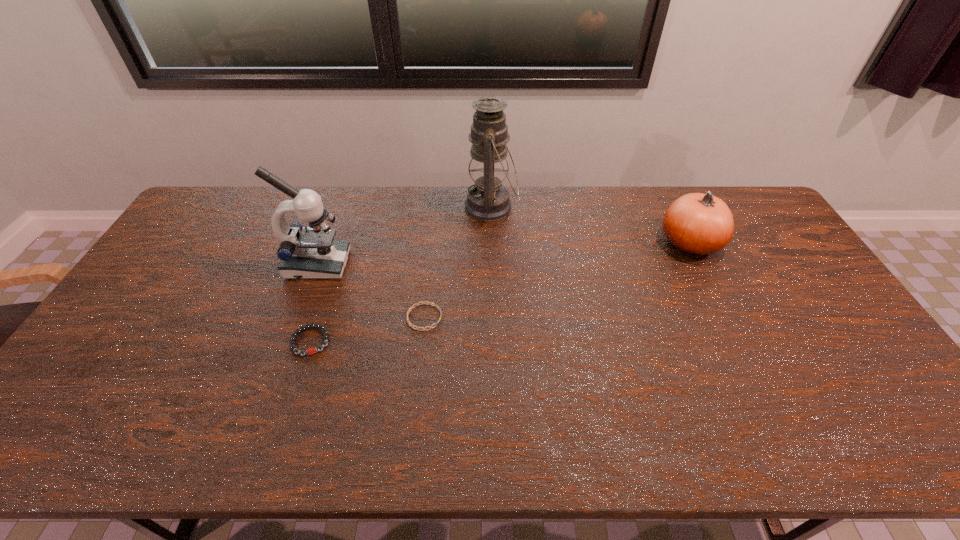
The height and width of the screenshot is (540, 960). What are the coordinates of `object that can be found as the closest to the taller bracelet` in the screenshot? It's located at (312, 253).

Choose which object is the nearest neighbor to the oil lamp. Please provide its 2D coordinates. Your answer should be formatted as a tuple, i.e. [(x, y)], where the tuple contains the x and y coordinates of a point satisfying the conditions above.

[(416, 304)]

Locate an element on the screen. free space that satisfies the following two spatial constraints: 1. at the eyepiece of the microscope; 2. on the left side of the left bracelet is located at coordinates (290, 341).

Identify the location of free location that satisfies the following two spatial constraints: 1. at the eyepiece of the left bracelet; 2. on the right side of the microscope. (290, 341).

Identify the location of vacant space that satisfies the following two spatial constraints: 1. on the back side of the rightmost object; 2. on the right side of the taller bracelet. The width and height of the screenshot is (960, 540). (343, 242).

This screenshot has height=540, width=960. I want to click on free space that satisfies the following two spatial constraints: 1. on the back side of the second shortest object; 2. at the eyepiece of the microscope, so click(336, 265).

The width and height of the screenshot is (960, 540). I want to click on blank space that satisfies the following two spatial constraints: 1. at the eyepiece of the microscope; 2. on the left side of the taller bracelet, so click(290, 341).